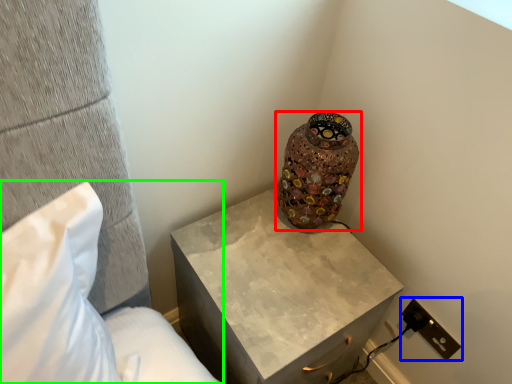
Question: Based on their relative distances, which object is farther from vase (highlighted by a red box)? Choose from electric outlet (highlighted by a blue box) and furniture (highlighted by a green box).

Choices:
 (A) electric outlet
 (B) furniture

Answer: (B)